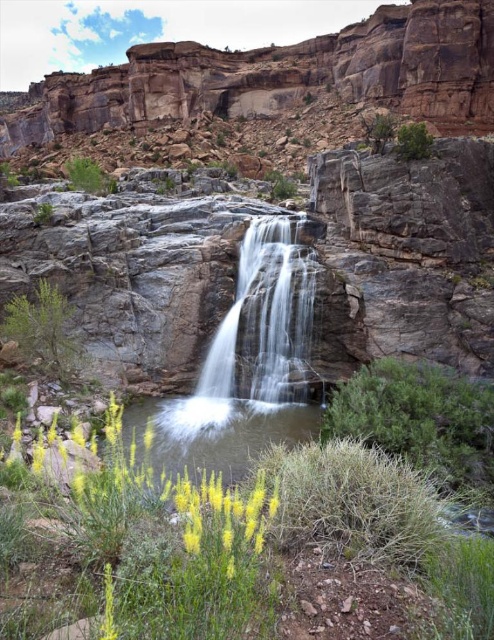
You are planning to build a small wooden bridge over the white smooth waterfall at center and the green leafy shrub at upper left. Which object requires the bridge to be wider to accommodate its width?

The green leafy shrub at upper left requires the bridge to be wider because its width is greater than the white smooth waterfall at center.

You are a photographer standing at the edge of the small pool below the white smooth waterfall at center. You want to take a photo of the green leafy bush at upper right without the waterfall blocking the view. Is this possible given their positions?

The white smooth waterfall at center is in front of the green leafy bush at upper right, so it would block the view. To capture the bush without the waterfall, you would need to reposition yourself to a spot where the waterfall is not between you and the bush.